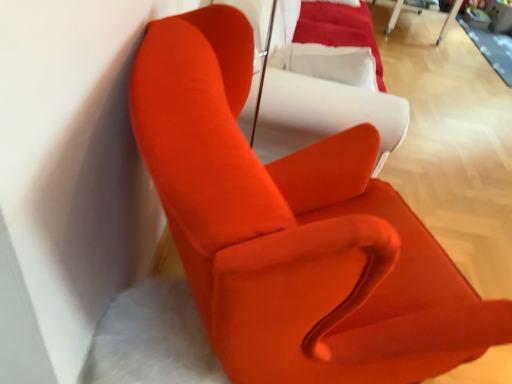
Question: Is matte orange armchair at upper left located outside satin white couch at center?

Choices:
 (A) no
 (B) yes

Answer: (B)

Question: Does matte orange armchair at upper left have a lesser width compared to satin white couch at center?

Choices:
 (A) no
 (B) yes

Answer: (A)

Question: From a real-world perspective, is matte orange armchair at upper left over satin white couch at center?

Choices:
 (A) yes
 (B) no

Answer: (B)

Question: Could you tell me if matte orange armchair at upper left is turned towards satin white couch at center?

Choices:
 (A) yes
 (B) no

Answer: (B)

Question: Does matte orange armchair at upper left have a smaller size compared to satin white couch at center?

Choices:
 (A) yes
 (B) no

Answer: (B)

Question: Is matte orange armchair at upper left in front of or behind white plastic table at upper right in the image?

Choices:
 (A) front
 (B) behind

Answer: (A)

Question: Is point (312, 359) positioned closer to the camera than point (459, 3)?

Choices:
 (A) farther
 (B) closer

Answer: (B)

Question: In the image, is matte orange armchair at upper left on the left side or the right side of white plastic table at upper right?

Choices:
 (A) left
 (B) right

Answer: (A)

Question: Considering the positions of matte orange armchair at upper left and white plastic table at upper right in the image, is matte orange armchair at upper left wider or thinner than white plastic table at upper right?

Choices:
 (A) wide
 (B) thin

Answer: (B)

Question: Visually, is satin white couch at center positioned to the left or to the right of white plastic table at upper right?

Choices:
 (A) right
 (B) left

Answer: (B)

Question: Is satin white couch at center spatially inside white plastic table at upper right, or outside of it?

Choices:
 (A) outside
 (B) inside

Answer: (A)

Question: Considering the positions of satin white couch at center and white plastic table at upper right in the image, is satin white couch at center bigger or smaller than white plastic table at upper right?

Choices:
 (A) small
 (B) big

Answer: (A)

Question: Relative to white plastic table at upper right, is satin white couch at center in front or behind?

Choices:
 (A) front
 (B) behind

Answer: (A)

Question: In terms of size, does white plastic table at upper right appear bigger or smaller than satin white couch at center?

Choices:
 (A) big
 (B) small

Answer: (A)

Question: Is white plastic table at upper right in front of or behind satin white couch at center in the image?

Choices:
 (A) front
 (B) behind

Answer: (B)